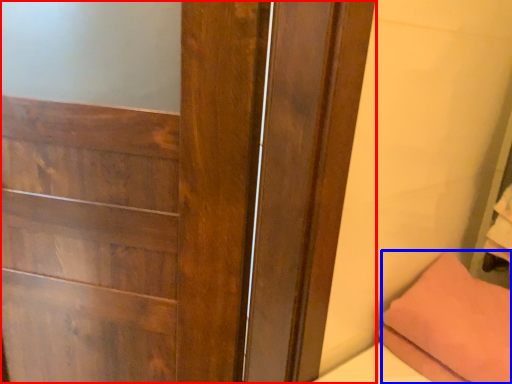
Question: Which of the following is the farthest to the observer, door (highlighted by a red box) or pillow (highlighted by a blue box)?

Choices:
 (A) door
 (B) pillow

Answer: (B)